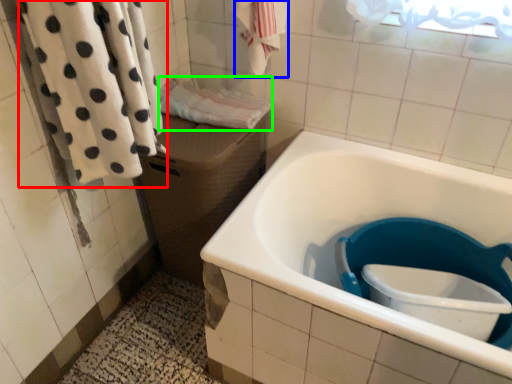
Question: Based on their relative distances, which object is farther from bath towel (highlighted by a red box)? Choose from bath towel (highlighted by a blue box) and bath towel (highlighted by a green box).

Choices:
 (A) bath towel
 (B) bath towel

Answer: (A)